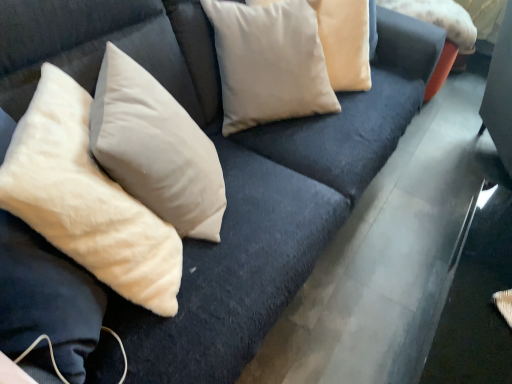
Question: From their relative heights in the image, would you say beige cotton pillow at upper center, placed as the 2th pillow when sorted from right to left, is taller or shorter than beige cotton pillow at upper right, the first pillow from the right?

Choices:
 (A) tall
 (B) short

Answer: (A)

Question: Does point (353, 14) appear closer or farther from the camera than point (430, 18)?

Choices:
 (A) closer
 (B) farther

Answer: (A)

Question: Estimate the real-world distances between objects in this image. Which object is farther from the beige cotton pillow at upper right, the first pillow from the right?

Choices:
 (A) beige velvet pillow at upper center, acting as the 3th pillow starting from the right
 (B) beige soft pillow at left, the 4th pillow viewed from the right
 (C) beige cotton pillow at upper center, placed as the 2th pillow when sorted from right to left

Answer: (B)

Question: Which object is the closest to the beige cotton pillow at upper center, which appears as the third pillow when viewed from the left?

Choices:
 (A) beige soft pillow at left, the first pillow from the left
 (B) beige velvet pillow at upper center, acting as the 3th pillow starting from the right
 (C) beige cotton pillow at upper right, the fourth pillow when ordered from left to right

Answer: (B)